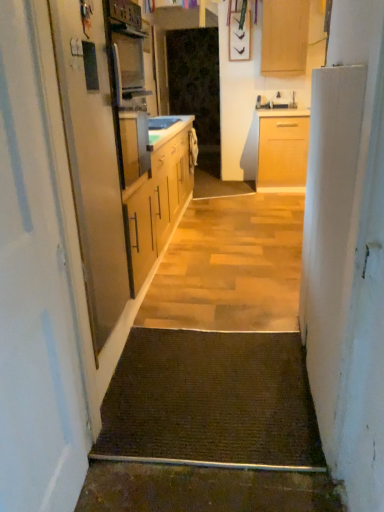
Question: From the image's perspective, is metallic silver screen door at left, which is counted as the 2th screen door, starting from the back, above brown textured mat at center?

Choices:
 (A) no
 (B) yes

Answer: (B)

Question: Considering the relative positions of metallic silver screen door at left, placed as the first screen door when sorted from front to back, and brown textured mat at center in the image provided, is metallic silver screen door at left, placed as the first screen door when sorted from front to back, in front of brown textured mat at center?

Choices:
 (A) yes
 (B) no

Answer: (A)

Question: From a real-world perspective, is metallic silver screen door at left, the 2th screen door from the top, physically above brown textured mat at center?

Choices:
 (A) yes
 (B) no

Answer: (A)

Question: Would you say metallic silver screen door at left, the first screen door positioned from the bottom, is outside brown textured mat at center?

Choices:
 (A) no
 (B) yes

Answer: (B)

Question: Can you confirm if metallic silver screen door at left, the 2th screen door when ordered from right to left, is positioned to the right of brown textured mat at center?

Choices:
 (A) no
 (B) yes

Answer: (A)

Question: Can you confirm if metallic silver screen door at left, which is counted as the 2th screen door, starting from the back, is shorter than brown textured mat at center?

Choices:
 (A) yes
 (B) no

Answer: (B)

Question: Is white glossy sink at center located outside metallic silver screen door at left, which is counted as the 2th screen door, starting from the back?

Choices:
 (A) yes
 (B) no

Answer: (A)

Question: From the image's perspective, is white glossy sink at center above metallic silver screen door at left, which is counted as the 2th screen door, starting from the back?

Choices:
 (A) no
 (B) yes

Answer: (B)

Question: From the image's perspective, is white glossy sink at center beneath metallic silver screen door at left, the first screen door positioned from the bottom?

Choices:
 (A) yes
 (B) no

Answer: (B)

Question: From a real-world perspective, is white glossy sink at center located higher than metallic silver screen door at left, placed as the first screen door when sorted from front to back?

Choices:
 (A) no
 (B) yes

Answer: (A)

Question: Could you tell me if white glossy sink at center is facing metallic silver screen door at left, which is counted as the 2th screen door, starting from the back?

Choices:
 (A) no
 (B) yes

Answer: (A)

Question: Can you confirm if white glossy sink at center is positioned to the right of metallic silver screen door at left, which appears as the 1th screen door when viewed from the left?

Choices:
 (A) no
 (B) yes

Answer: (B)

Question: From a real-world perspective, is light wood cabinet at upper center positioned under white glossy sink at center based on gravity?

Choices:
 (A) yes
 (B) no

Answer: (B)